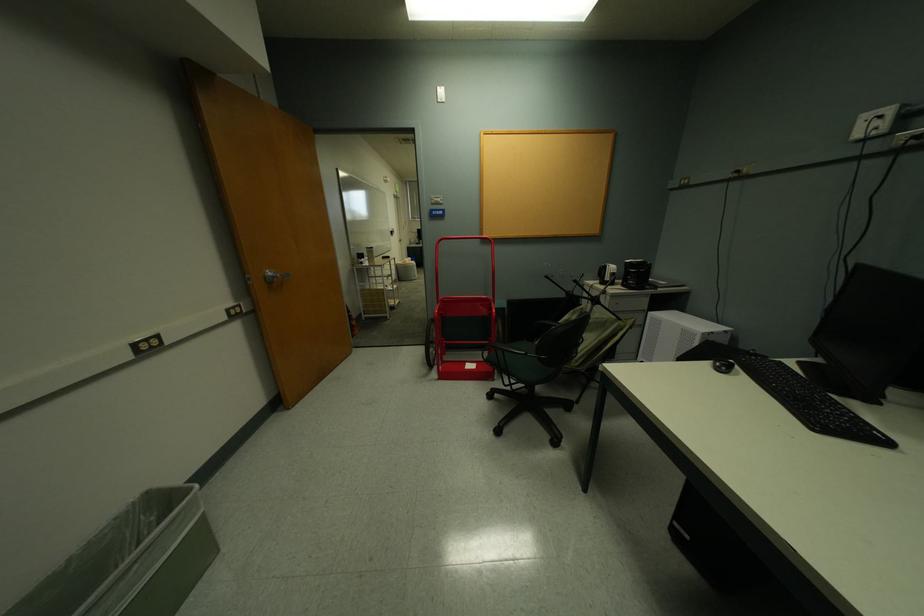
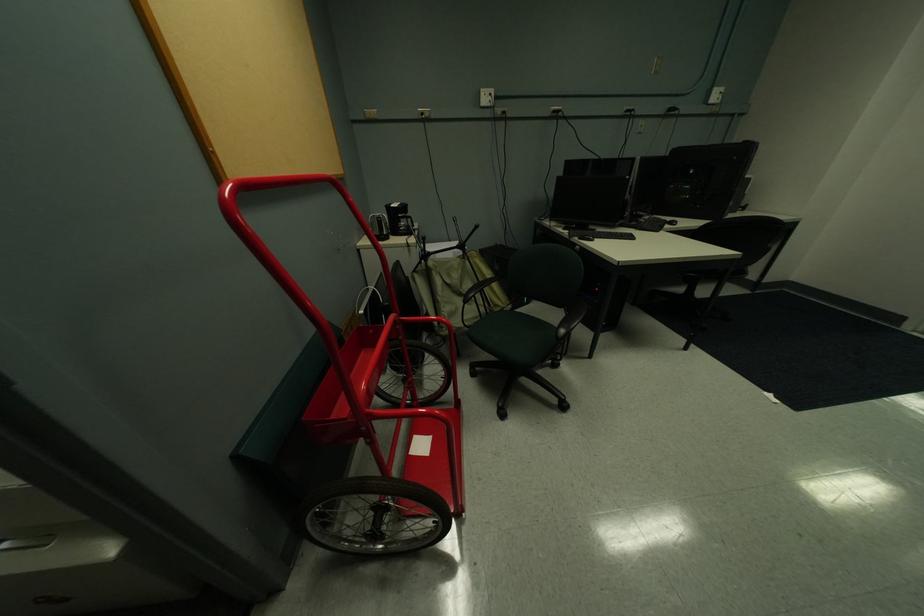
The point at (641, 286) is marked in the first image. Where is the corresponding point in the second image?

(412, 232)